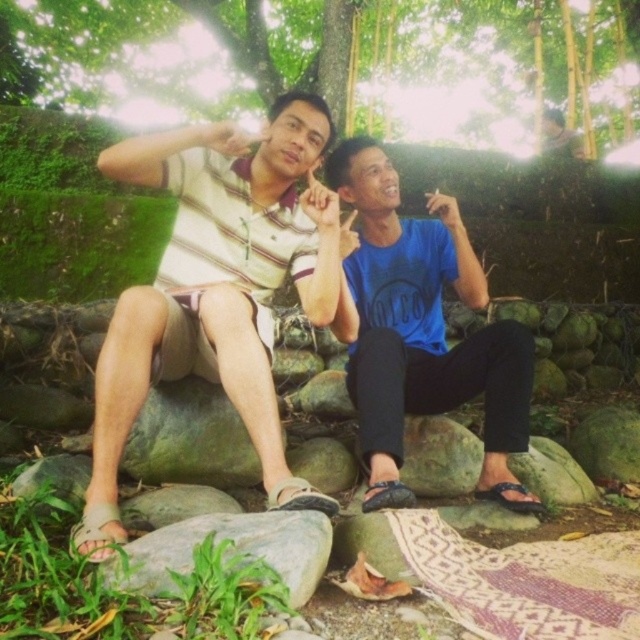
You are planning to place a small decorative item on the gray smooth rock at lower center and the green mossy rock at center. Based on their sizes, which rock would be more suitable for placing the item to ensure stability?

The gray smooth rock at lower center is larger in size than the green mossy rock at center, so it would provide a more stable base for placing the small decorative item.

You are a photographer trying to capture the striped cotton shirt at center and the green grass at lower left in the same frame. Which object should you focus on first if you want to ensure both are in focus, considering their heights?

The striped cotton shirt at center is taller than the green grass at lower left, so focusing on the striped cotton shirt at center first would help ensure both are in focus as it is the taller object.

You are a photographer trying to capture a closeup of the striped cotton shirt at center. Based on its coordinates, where should you position your camera relative to the scene?

The striped cotton shirt at center is located at coordinates point (218, 288), so you should position your camera slightly to the right and lower than the center of the scene to capture it effectively.